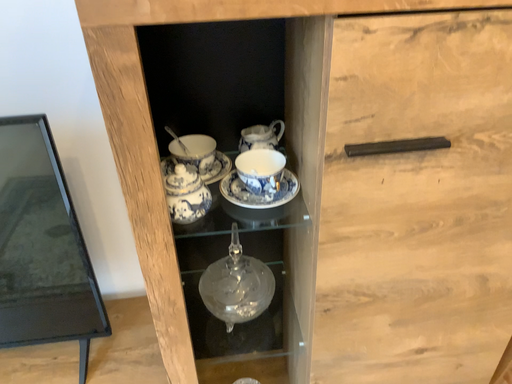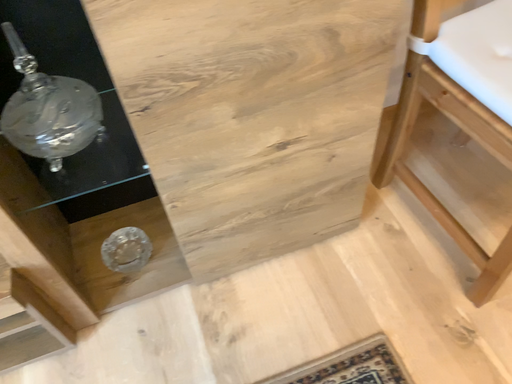
Question: Which way did the camera rotate in the video?

Choices:
 (A) rotated upward
 (B) rotated downward

Answer: (B)